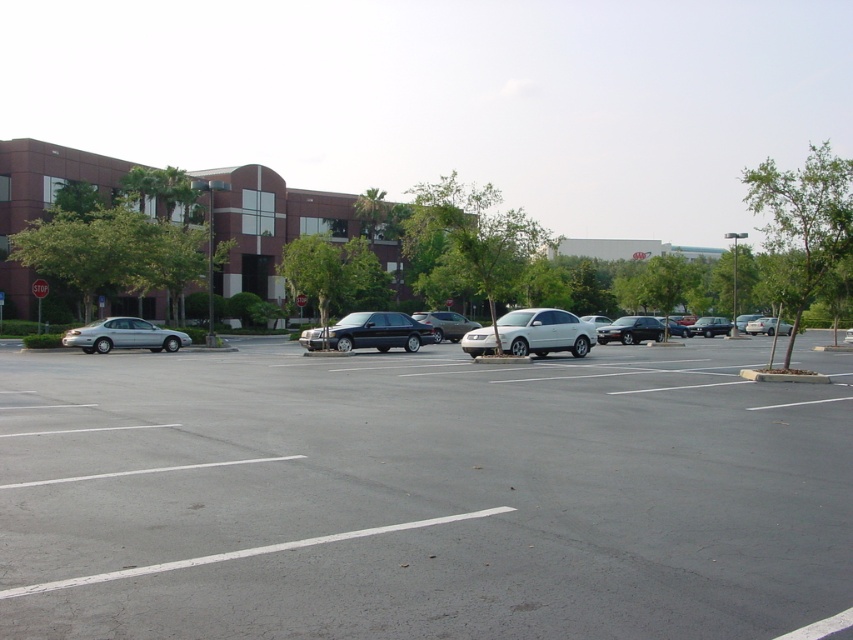
Does silver metallic car at center come in front of silver metallic sedan at left?

Yes, it is in front of silver metallic sedan at left.

Who is more distant from viewer, (126, 513) or (148, 342)?

The point (148, 342) is behind.

Between point (631, 390) and point (155, 326), which one is positioned behind?

Positioned behind is point (155, 326).

Find the location of a particular element. silver metallic car at center is located at coordinates (422, 493).

Can you confirm if silver metallic sedan at left is positioned to the left of shiny black sedan at center-right?

Correct, you'll find silver metallic sedan at left to the left of shiny black sedan at center-right.

Does silver metallic sedan at left have a greater height compared to shiny black sedan at center-right?

Incorrect, silver metallic sedan at left's height is not larger of shiny black sedan at center-right's.

Is point (67, 337) positioned behind point (711, 323)?

That is False.

Where is `silver metallic sedan at left`? silver metallic sedan at left is located at coordinates (123, 336).

Can you confirm if silver metallic sedan at center is bigger than shiny black sedan at center-right?

Correct, silver metallic sedan at center is larger in size than shiny black sedan at center-right.

Does silver metallic sedan at center have a lesser width compared to shiny black sedan at center-right?

Indeed, silver metallic sedan at center has a lesser width compared to shiny black sedan at center-right.

Who is more distant from viewer, [427,312] or [706,321]?

Point [706,321]

The image size is (853, 640). Identify the location of silver metallic sedan at center. (445, 324).